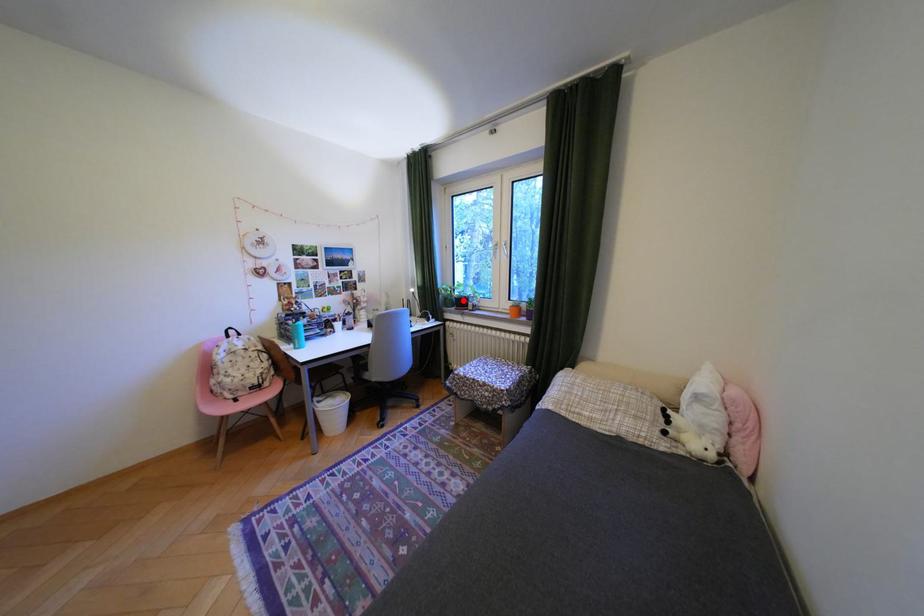
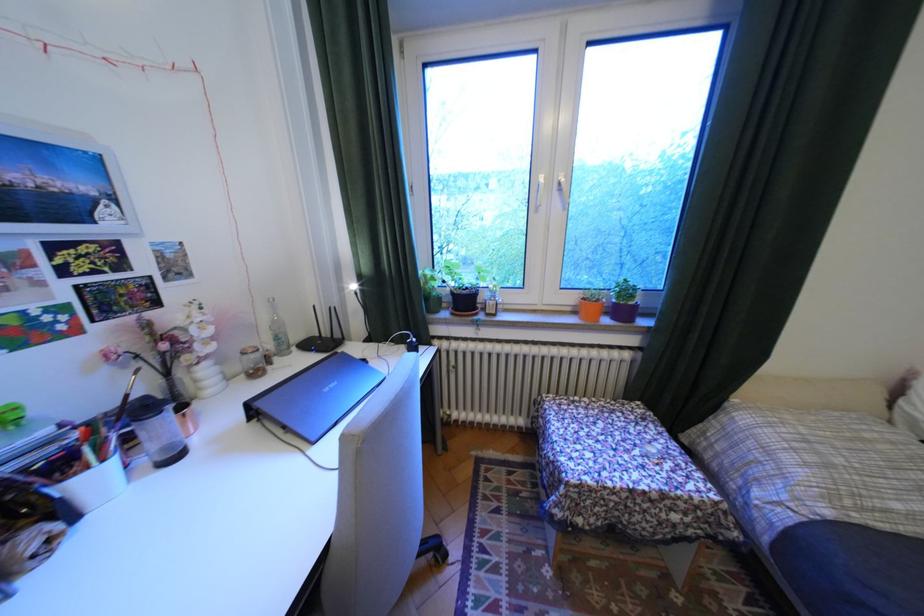
Locate, in the second image, the point that corresponds to the highlighted location in the first image.

(451, 299)